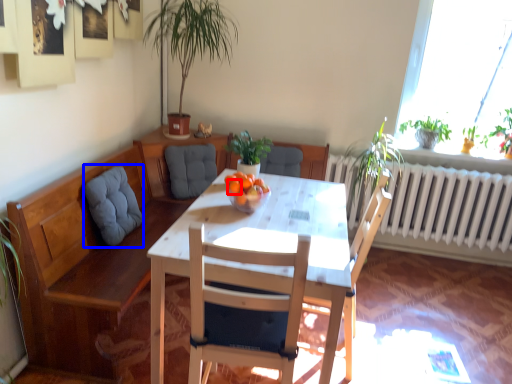
Question: Among these objects, which one is farthest to the camera, orange (highlighted by a red box) or swivel chair (highlighted by a blue box)?

Choices:
 (A) orange
 (B) swivel chair

Answer: (B)